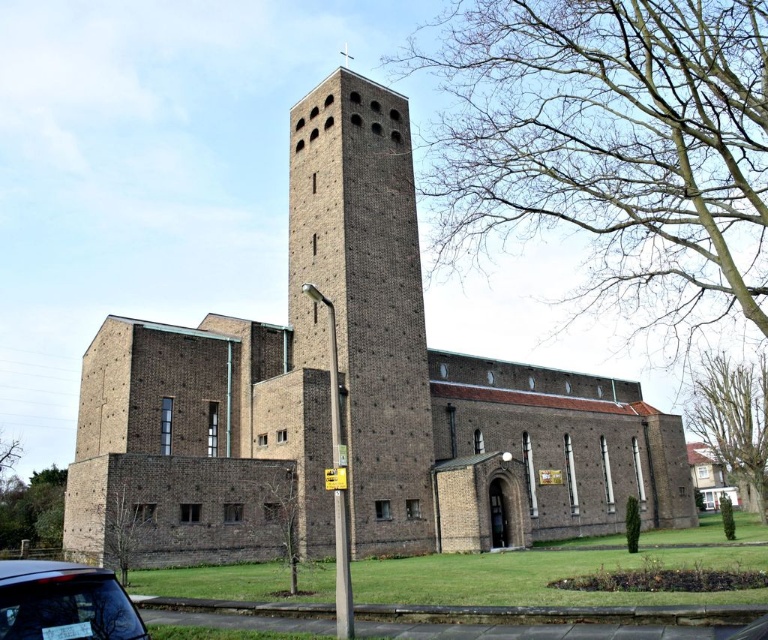
Can you confirm if brown brick tower at center is bigger than matte black car at lower left?

Yes, brown brick tower at center is bigger than matte black car at lower left.

Based on the photo, who is positioned more to the left, brown brick tower at center or matte black car at lower left?

From the viewer's perspective, matte black car at lower left appears more on the left side.

The image size is (768, 640). What do you see at coordinates (363, 298) in the screenshot?
I see `brown brick tower at center` at bounding box center [363, 298].

You are a GUI agent. You are given a task and a screenshot of the screen. Output one action in this format:
    pyautogui.click(x=<x>, y=<y>)
    Task: Click on the brown brick tower at center
    This screenshot has height=640, width=768.
    Given the screenshot: What is the action you would take?
    pyautogui.click(x=363, y=298)

At what (x,y) coordinates should I click in order to perform the action: click on brown brick church at center. Please return your answer as a coordinate pair (x, y). The image size is (768, 640). Looking at the image, I should click on (349, 400).

Is brown brick church at center thinner than matte black car at lower left?

Incorrect, brown brick church at center's width is not less than matte black car at lower left's.

Is point (485, 369) positioned after point (38, 611)?

Yes, it is behind point (38, 611).

This screenshot has width=768, height=640. I want to click on brown brick church at center, so click(349, 400).

Is brown brick church at center positioned behind brown brick tower at center?

No, it is in front of brown brick tower at center.

In the scene shown: Can you confirm if brown brick church at center is thinner than brown brick tower at center?

In fact, brown brick church at center might be wider than brown brick tower at center.

The width and height of the screenshot is (768, 640). What do you see at coordinates (349, 400) in the screenshot?
I see `brown brick church at center` at bounding box center [349, 400].

This screenshot has height=640, width=768. I want to click on brown brick church at center, so click(x=349, y=400).